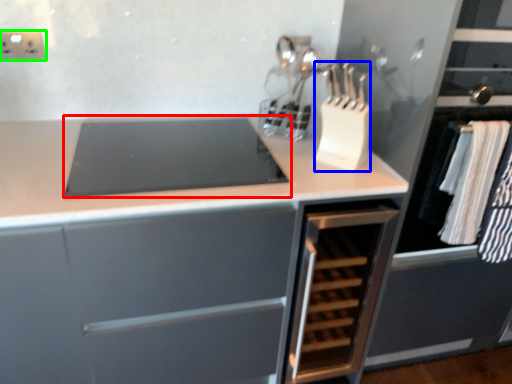
Question: Considering the real-world distances, which object is closest to home appliance (highlighted by a red box)? kitchen appliance (highlighted by a blue box) or electric outlet (highlighted by a green box).

Choices:
 (A) kitchen appliance
 (B) electric outlet

Answer: (A)